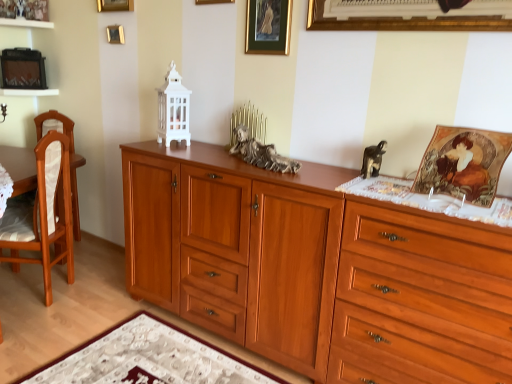
Locate an element on the screen. This screenshot has height=384, width=512. free point above white textured mat at lower center (from a real-world perspective) is located at coordinates (147, 357).